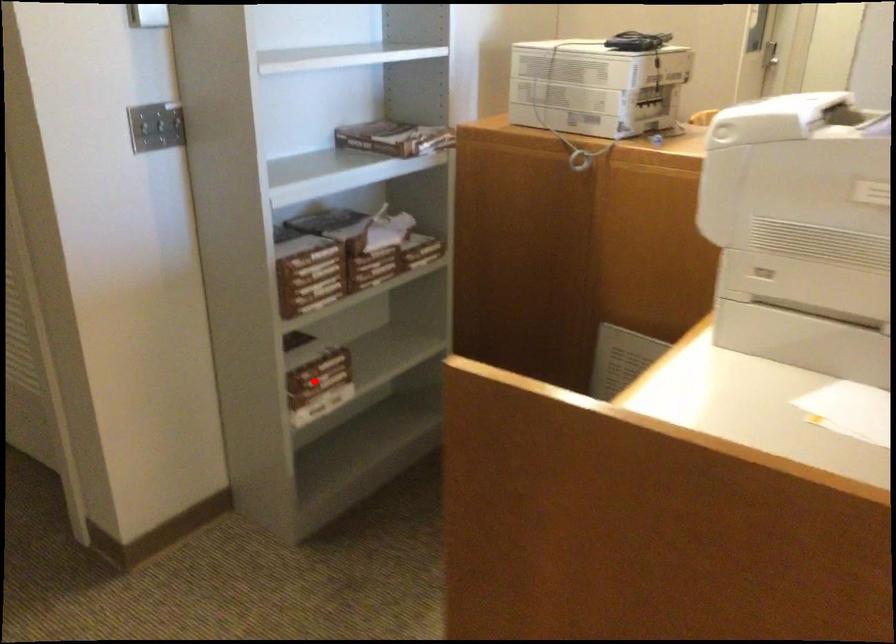
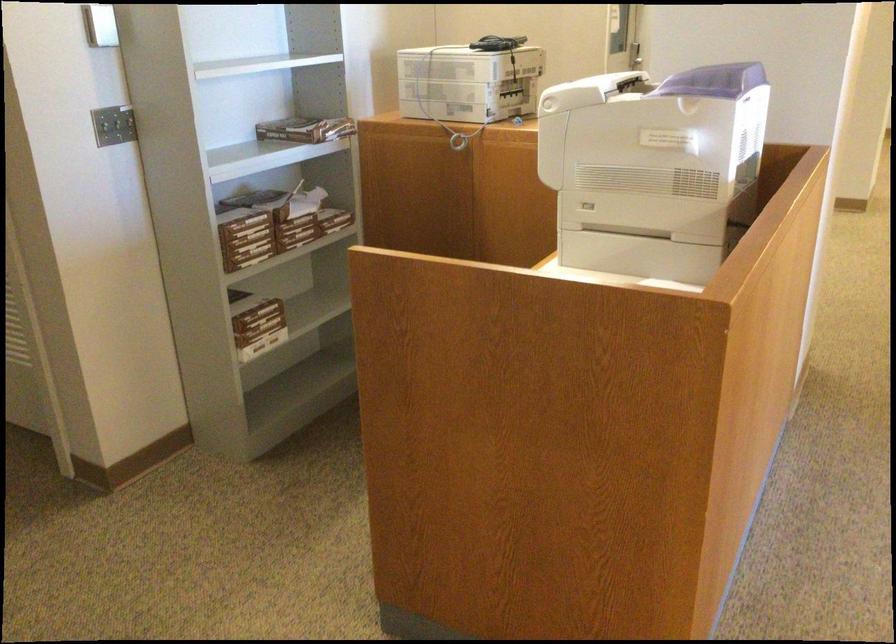
Locate, in the second image, the point that corresponds to the highlighted location in the first image.

(257, 321)